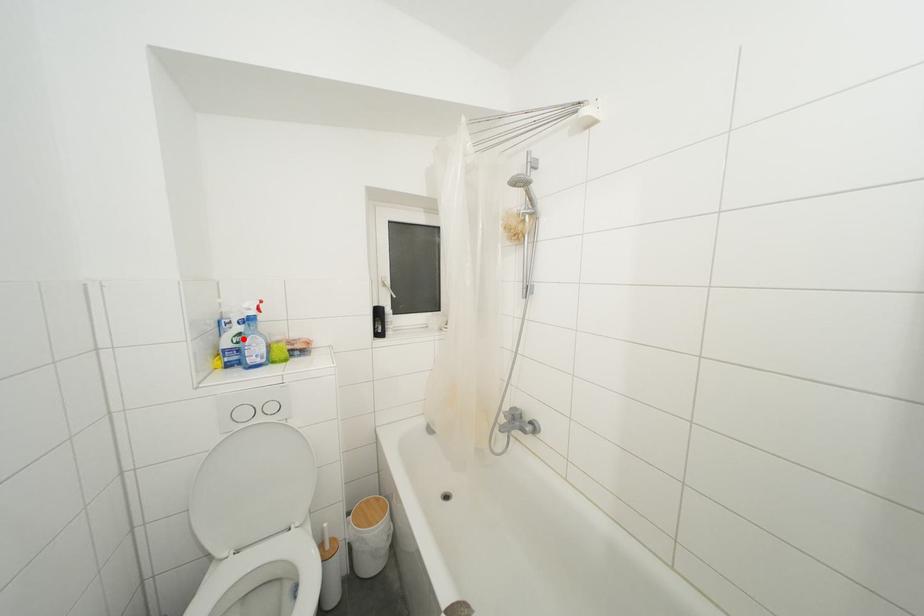
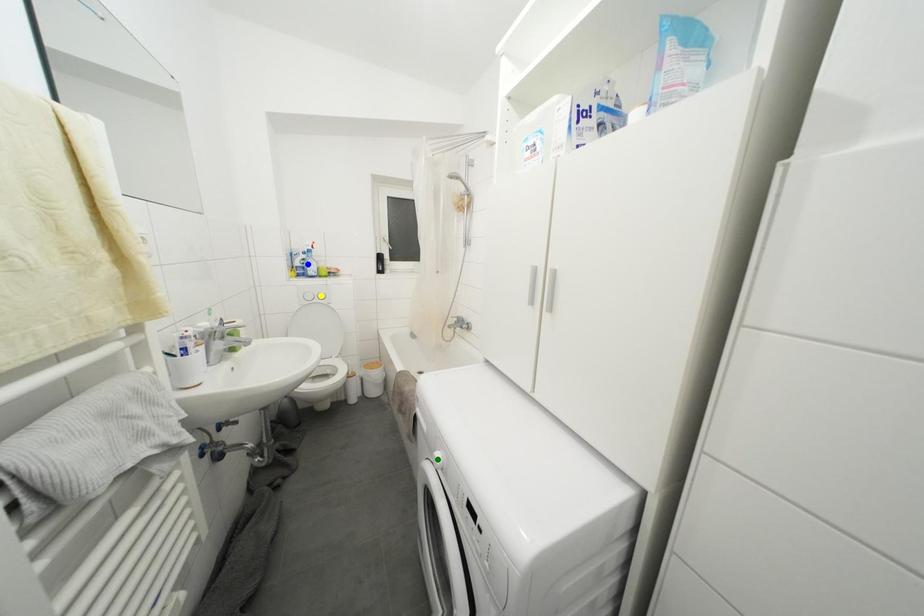
Question: I am providing you with two images of the same scene from different viewpoints. A red point is marked on the first image. You are given multiple points on the second image. Can you choose the point in image 2 that corresponds to the point in image 1?

Choices:
 (A) blue point
 (B) yellow point
 (C) green point

Answer: (A)